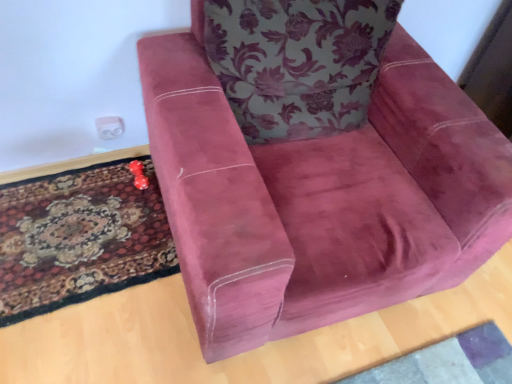
What is the approximate width of rubberized red dice at lower left?

The width of rubberized red dice at lower left is 6.43 inches.

Image resolution: width=512 pixels, height=384 pixels. In order to click on velvet maroon armchair at center in this screenshot , I will do `click(320, 197)`.

In order to face floral fabric cushion at upper center, should I rotate leftwards or rightwards?

Turn right by 6.874 degrees to look at floral fabric cushion at upper center.

Locate an element on the screen. The height and width of the screenshot is (384, 512). rubberized red dice at lower left is located at coordinates (138, 175).

From a real-world perspective, who is located higher, rubberized red dice at lower left or carpeted rug at lower left?

rubberized red dice at lower left.

Between point (136, 183) and point (115, 258), which one is positioned in front?

The point (115, 258) is closer to the camera.

Is rubberized red dice at lower left bigger than carpeted rug at lower left?

No, rubberized red dice at lower left is not bigger than carpeted rug at lower left.

From the image's perspective, does rubberized red dice at lower left appear higher than carpeted rug at lower left?

Yes, from the image's perspective, rubberized red dice at lower left is on top of carpeted rug at lower left.

Does rubberized red dice at lower left have a lesser width compared to floral fabric cushion at upper center?

Indeed, rubberized red dice at lower left has a lesser width compared to floral fabric cushion at upper center.

What's the angular difference between rubberized red dice at lower left and floral fabric cushion at upper center's facing directions?

The angle between the facing direction of rubberized red dice at lower left and the facing direction of floral fabric cushion at upper center is 3.13 degrees.

Does rubberized red dice at lower left have a larger size compared to floral fabric cushion at upper center?

No.

Can you tell me how much floral fabric cushion at upper center and carpeted rug at lower left differ in facing direction?

There is a 3.13-degree angle between the facing directions of floral fabric cushion at upper center and carpeted rug at lower left.

Is the surface of floral fabric cushion at upper center in direct contact with carpeted rug at lower left?

No, floral fabric cushion at upper center is not beside carpeted rug at lower left.

From a real-world perspective, relative to carpeted rug at lower left, is floral fabric cushion at upper center vertically above or below?

In terms of real-world spatial position, floral fabric cushion at upper center is above carpeted rug at lower left.

Would you say floral fabric cushion at upper center is inside or outside carpeted rug at lower left?

floral fabric cushion at upper center is not inside carpeted rug at lower left, it's outside.

Which object is positioned more to the left, carpeted rug at lower left or rubberized red dice at lower left?

carpeted rug at lower left is more to the left.

Between carpeted rug at lower left and rubberized red dice at lower left, which one has more height?

Standing taller between the two is rubberized red dice at lower left.

Is carpeted rug at lower left facing towards rubberized red dice at lower left?

No, carpeted rug at lower left is not aimed at rubberized red dice at lower left.

From the image's perspective, is carpeted rug at lower left beneath rubberized red dice at lower left?

Yes, from the image's perspective, carpeted rug at lower left is below rubberized red dice at lower left.

The width and height of the screenshot is (512, 384). Find the location of `toy located underneath the floral fabric cushion at upper center (from a real-world perspective)`. toy located underneath the floral fabric cushion at upper center (from a real-world perspective) is located at coordinates (138, 175).

Can you confirm if floral fabric cushion at upper center is taller than rubberized red dice at lower left?

Correct, floral fabric cushion at upper center is much taller as rubberized red dice at lower left.

Is the surface of floral fabric cushion at upper center in direct contact with rubberized red dice at lower left?

No, floral fabric cushion at upper center is not with rubberized red dice at lower left.

Which object is further away from the camera, velvet maroon armchair at center or rubberized red dice at lower left?

rubberized red dice at lower left is behind.

Considering the points (396, 151) and (132, 173), which point is in front, point (396, 151) or point (132, 173)?

Point (396, 151)

Is velvet maroon armchair at center thinner than rubberized red dice at lower left?

In fact, velvet maroon armchair at center might be wider than rubberized red dice at lower left.

Is rubberized red dice at lower left bigger or smaller than velvet maroon armchair at center?

Considering their sizes, rubberized red dice at lower left takes up less space than velvet maroon armchair at center.

From a real-world perspective, which object stands above the other?

From a 3D spatial view, velvet maroon armchair at center is above.

Could you tell me if rubberized red dice at lower left is facing velvet maroon armchair at center?

No, rubberized red dice at lower left is not aimed at velvet maroon armchair at center.

Which of these two, rubberized red dice at lower left or velvet maroon armchair at center, stands shorter?

rubberized red dice at lower left is shorter.

Locate an element on the screen. toy that is behind the carpeted rug at lower left is located at coordinates (138, 175).

This screenshot has width=512, height=384. Identify the location of toy lying on the left of floral fabric cushion at upper center. (138, 175).

From the image, which object appears to be farther from floral fabric cushion at upper center, carpeted rug at lower left or velvet maroon armchair at center?

Based on the image, carpeted rug at lower left appears to be further to floral fabric cushion at upper center.

Considering their positions, is rubberized red dice at lower left positioned further to carpeted rug at lower left than velvet maroon armchair at center?

Among the two, velvet maroon armchair at center is located further to carpeted rug at lower left.

Looking at the image, which one is located further to velvet maroon armchair at center, floral fabric cushion at upper center or carpeted rug at lower left?

carpeted rug at lower left lies further to velvet maroon armchair at center than the other object.

Looking at the image, which one is located further to floral fabric cushion at upper center, velvet maroon armchair at center or carpeted rug at lower left?

Among the two, carpeted rug at lower left is located further to floral fabric cushion at upper center.

Which object lies further to the anchor point rubberized red dice at lower left, velvet maroon armchair at center or carpeted rug at lower left?

velvet maroon armchair at center lies further to rubberized red dice at lower left than the other object.

Looking at the image, which one is located closer to carpeted rug at lower left, velvet maroon armchair at center or rubberized red dice at lower left?

rubberized red dice at lower left is positioned closer to the anchor carpeted rug at lower left.

Considering their positions, is rubberized red dice at lower left positioned further to velvet maroon armchair at center than carpeted rug at lower left?

Based on the image, rubberized red dice at lower left appears to be further to velvet maroon armchair at center.

Looking at the image, which one is located further to rubberized red dice at lower left, floral fabric cushion at upper center or velvet maroon armchair at center?

Among the two, velvet maroon armchair at center is located further to rubberized red dice at lower left.

Locate an element on the screen. This screenshot has width=512, height=384. throw pillow located between velvet maroon armchair at center and rubberized red dice at lower left in the depth direction is located at coordinates (297, 62).

You are a GUI agent. You are given a task and a screenshot of the screen. Output one action in this format:
    pyautogui.click(x=<x>, y=<y>)
    Task: Click on the throw pillow located between carpeted rug at lower left and velvet maroon armchair at center in the left-right direction
    
    Given the screenshot: What is the action you would take?
    pyautogui.click(x=297, y=62)

Where is `mat between velvet maroon armchair at center and rubberized red dice at lower left along the z-axis`? mat between velvet maroon armchair at center and rubberized red dice at lower left along the z-axis is located at coordinates (80, 238).

Identify the location of toy between carpeted rug at lower left and floral fabric cushion at upper center. Image resolution: width=512 pixels, height=384 pixels. (138, 175).